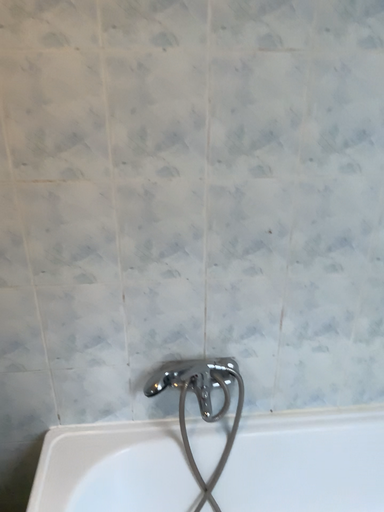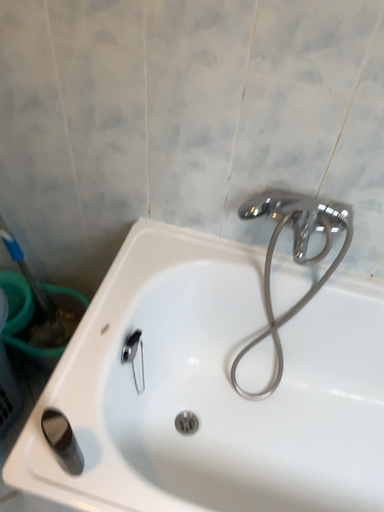
Question: How did the camera likely rotate when shooting the video?

Choices:
 (A) rotated upward
 (B) rotated downward

Answer: (B)